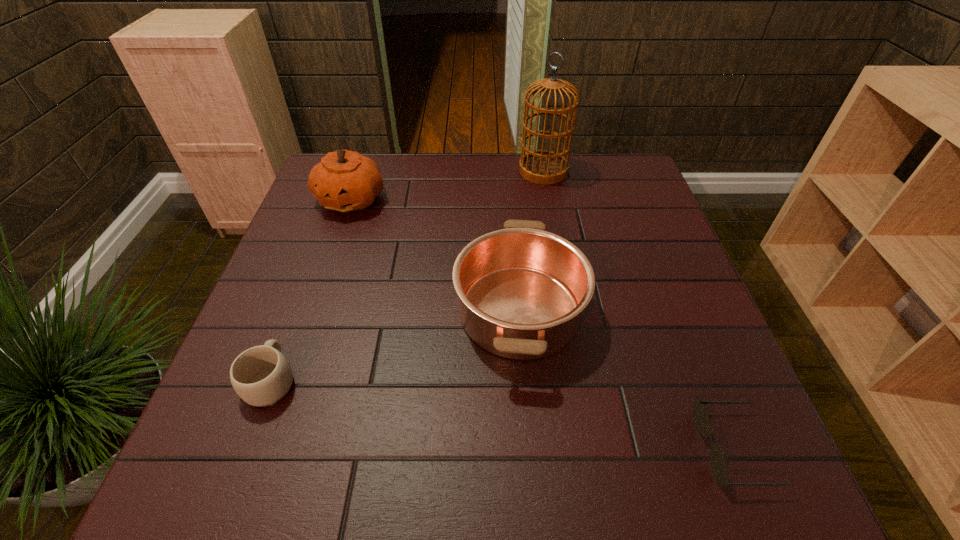
This screenshot has height=540, width=960. What are the coordinates of `vacant region located on the side of the fourth tallest object with the handle` in the screenshot? It's located at [x=295, y=318].

Locate an element on the screen. vacant region located on the side of the fourth tallest object with the handle is located at coordinates (328, 227).

In order to click on blank space located on the front-facing side of the shortest object in this screenshot , I will do `click(480, 448)`.

The image size is (960, 540). I want to click on vacant area situated 0.340m on the front-facing side of the shortest object, so click(504, 448).

You are a GUI agent. You are given a task and a screenshot of the screen. Output one action in this format:
    pyautogui.click(x=<x>, y=<y>)
    Task: Click on the free region located on the front-facing side of the shortest object
    The width and height of the screenshot is (960, 540).
    Given the screenshot: What is the action you would take?
    pyautogui.click(x=620, y=448)

Locate an element on the screen. Image resolution: width=960 pixels, height=540 pixels. birdcage that is at the far edge is located at coordinates (541, 166).

Locate an element on the screen. This screenshot has height=540, width=960. pumpkin that is at the far edge is located at coordinates (345, 181).

The height and width of the screenshot is (540, 960). What are the coordinates of `object present at the near edge` in the screenshot? It's located at (719, 466).

Find the location of a particular element. pumpkin present at the left edge is located at coordinates (345, 181).

Find the location of a particular element. mug present at the left edge is located at coordinates (261, 376).